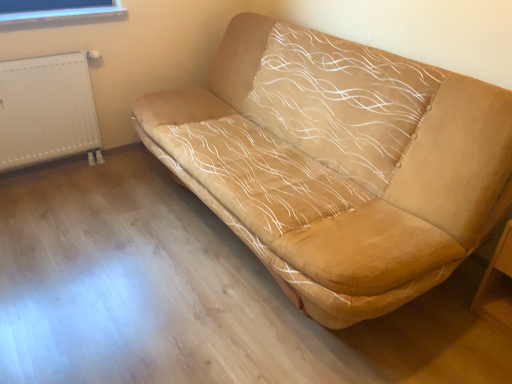
The height and width of the screenshot is (384, 512). I want to click on blank space to the left of suede-like beige sofa at center, so click(100, 235).